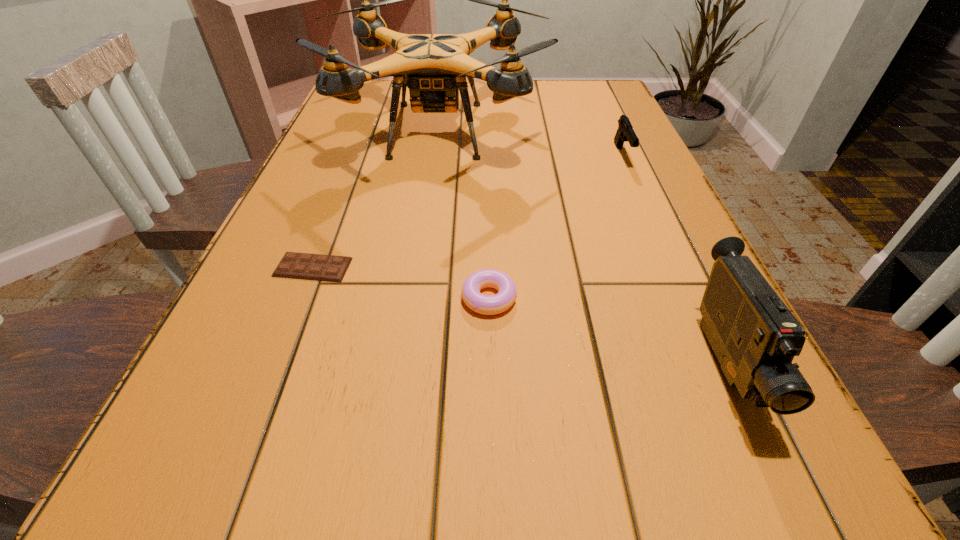
The image size is (960, 540). What are the coordinates of `drone present at the left edge` in the screenshot? It's located at (434, 67).

Image resolution: width=960 pixels, height=540 pixels. Find the location of `chocolate bar that is positioned at the left edge`. chocolate bar that is positioned at the left edge is located at coordinates (330, 268).

Locate an element on the screen. The height and width of the screenshot is (540, 960). camcorder that is at the right edge is located at coordinates (753, 334).

In order to click on pistol positioned at the right edge in this screenshot , I will do `click(625, 132)`.

I want to click on object that is at the far left corner, so click(434, 67).

This screenshot has width=960, height=540. In order to click on vacant space at the far edge of the desktop in this screenshot , I will do `click(528, 107)`.

The height and width of the screenshot is (540, 960). I want to click on vacant space at the near edge of the desktop, so click(x=280, y=495).

Image resolution: width=960 pixels, height=540 pixels. Identify the location of vacant space at the left edge of the desktop. click(x=238, y=327).

Find the location of a particular element. This screenshot has height=540, width=960. vacant space at the right edge is located at coordinates (x=651, y=177).

Identify the location of vacant space at the far left corner of the desktop. This screenshot has height=540, width=960. (373, 90).